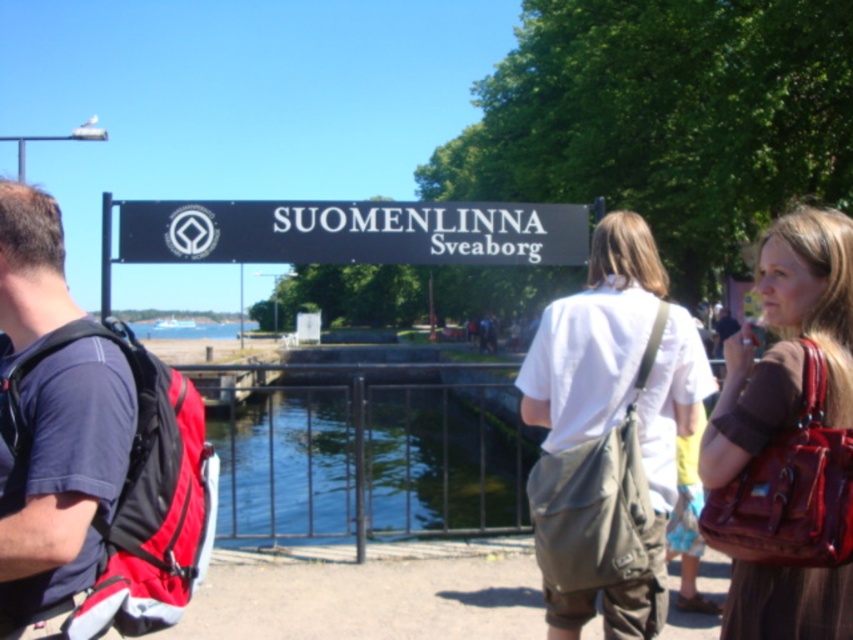
Question: Is white cotton shirt at center below black plastic sign at center?

Choices:
 (A) yes
 (B) no

Answer: (A)

Question: Estimate the real-world distances between objects in this image. Which object is farther from the dark blue fabric shirt at left?

Choices:
 (A) clear glass water at center
 (B) white cotton shirt at center
 (C) brown shiny handbag at center right
 (D) black plastic sign at center

Answer: (A)

Question: Which is nearer to the brown shiny handbag at center right?

Choices:
 (A) black plastic sign at center
 (B) clear glass water at center
 (C) dark blue fabric shirt at left

Answer: (C)

Question: In this image, where is dark blue fabric shirt at left located relative to white cotton shirt at center?

Choices:
 (A) right
 (B) left

Answer: (B)

Question: Considering the real-world distances, which object is closest to the dark blue fabric shirt at left?

Choices:
 (A) clear glass water at center
 (B) brown shiny handbag at center right
 (C) white cotton shirt at center

Answer: (C)

Question: Does brown shiny handbag at center right have a greater width compared to black plastic sign at center?

Choices:
 (A) no
 (B) yes

Answer: (B)